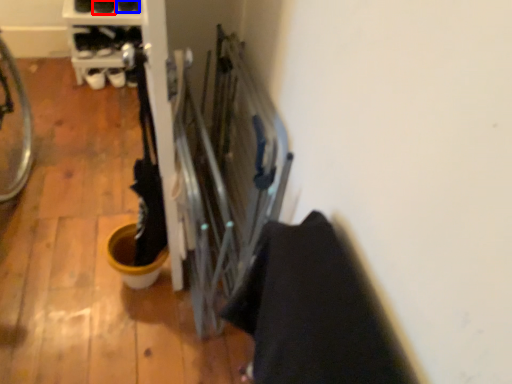
Question: Among these objects, which one is farthest to the camera, footwear (highlighted by a red box) or footwear (highlighted by a blue box)?

Choices:
 (A) footwear
 (B) footwear

Answer: (B)